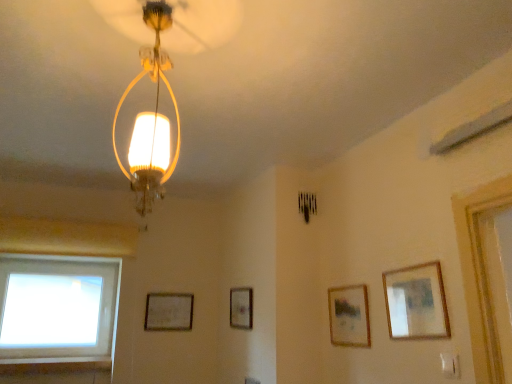
Question: Is there a large distance between transparent glass window at lower left and wooden picture frame at upper right, acting as the 1th picture frame starting from the front?

Choices:
 (A) yes
 (B) no

Answer: (A)

Question: From the image's perspective, is transparent glass window at lower left located beneath wooden picture frame at upper right, marked as the 1th picture frame in a right-to-left arrangement?

Choices:
 (A) yes
 (B) no

Answer: (A)

Question: Is transparent glass window at lower left to the left of wooden picture frame at upper right, marked as the 1th picture frame in a right-to-left arrangement, from the viewer's perspective?

Choices:
 (A) no
 (B) yes

Answer: (B)

Question: Is wooden picture frame at upper right, acting as the 1th picture frame starting from the front, at the back of transparent glass window at lower left?

Choices:
 (A) yes
 (B) no

Answer: (B)

Question: Considering the relative positions of transparent glass window at lower left and wooden picture frame at upper right, the fourth picture frame in the left-to-right sequence, in the image provided, is transparent glass window at lower left behind wooden picture frame at upper right, the fourth picture frame in the left-to-right sequence,?

Choices:
 (A) no
 (B) yes

Answer: (B)

Question: Can you confirm if transparent glass window at lower left is shorter than wooden picture frame at upper right, which is counted as the 4th picture frame, starting from the back?

Choices:
 (A) yes
 (B) no

Answer: (B)

Question: Does wooden framed picture at center right, arranged as the 3th picture frame when viewed from the left, come in front of matte glass lampshade at upper center?

Choices:
 (A) yes
 (B) no

Answer: (B)

Question: Can you confirm if wooden framed picture at center right, which is counted as the 3th picture frame, starting from the back, is positioned to the right of matte glass lampshade at upper center?

Choices:
 (A) yes
 (B) no

Answer: (A)

Question: From a real-world perspective, is wooden framed picture at center right, arranged as the 3th picture frame when viewed from the left, below matte glass lampshade at upper center?

Choices:
 (A) yes
 (B) no

Answer: (A)

Question: Is wooden framed picture at center right, arranged as the 3th picture frame when viewed from the left, positioned behind matte glass lampshade at upper center?

Choices:
 (A) yes
 (B) no

Answer: (A)

Question: Does wooden framed picture at center right, arranged as the 3th picture frame when viewed from the left, have a greater height compared to matte glass lampshade at upper center?

Choices:
 (A) no
 (B) yes

Answer: (A)

Question: Is wooden framed picture at center right, arranged as the 3th picture frame when viewed from the left, to the left of matte glass lampshade at upper center from the viewer's perspective?

Choices:
 (A) no
 (B) yes

Answer: (A)

Question: Can you confirm if matte glass lampshade at upper center is positioned to the right of transparent glass window at lower left?

Choices:
 (A) no
 (B) yes

Answer: (B)